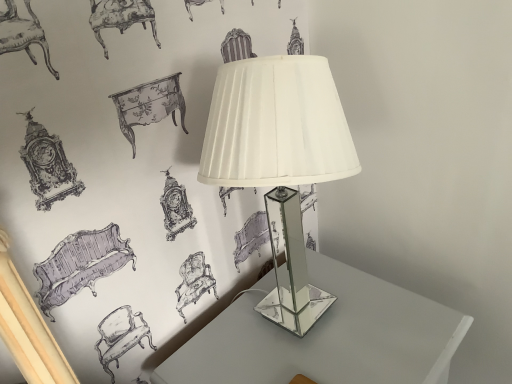
Find the location of a particular element. vacant area that is situated to the right of clear glass lamp at center is located at coordinates (396, 320).